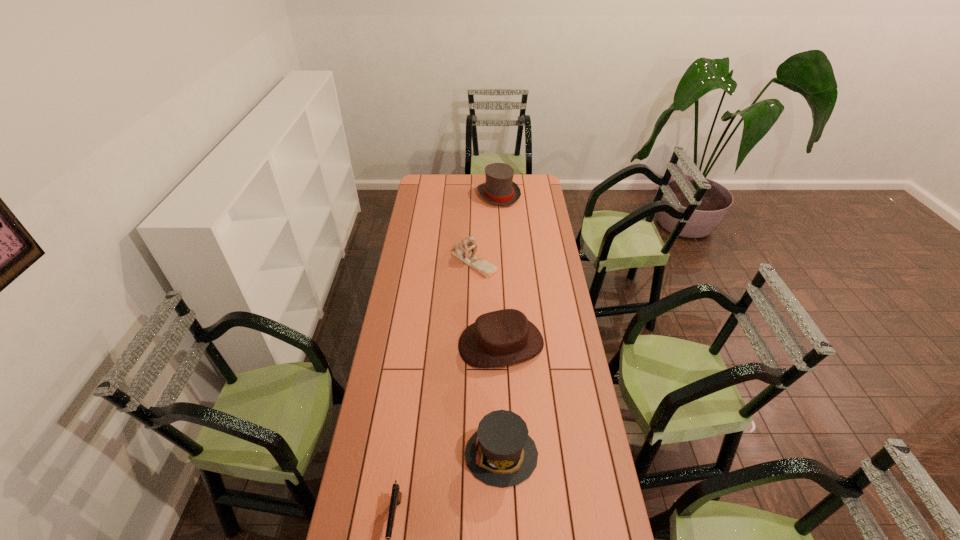
The width and height of the screenshot is (960, 540). What are the coordinates of `the farthest object` in the screenshot? It's located at (499, 189).

Find the location of a particular element. figurine is located at coordinates (x=463, y=249).

Where is `the second nearest object`? The height and width of the screenshot is (540, 960). the second nearest object is located at coordinates (500, 453).

At what (x,y) coordinates should I click in order to perform the action: click on the third farthest object. Please return your answer as a coordinate pair (x, y). This screenshot has height=540, width=960. Looking at the image, I should click on (504, 337).

I want to click on blank area located on the left of the farthest hat, so click(x=466, y=195).

Identify the location of free space located 0.150m on the front-facing side of the second farthest object. (473, 301).

At what (x,y) coordinates should I click in order to perform the action: click on free point located 0.290m with goggles on the front of the nearest hat. Please return your answer as a coordinate pair (x, y). Image resolution: width=960 pixels, height=540 pixels. Looking at the image, I should click on (377, 455).

This screenshot has height=540, width=960. I want to click on free space located with goggles on the front of the nearest hat, so click(387, 455).

At what (x,y) coordinates should I click in order to perform the action: click on vacant area situated 0.060m with goggles on the front of the nearest hat. Please return your answer as a coordinate pair (x, y). This screenshot has width=960, height=540. Looking at the image, I should click on (446, 455).

Where is `blank area located 0.050m on the back of the third farthest object`? The height and width of the screenshot is (540, 960). blank area located 0.050m on the back of the third farthest object is located at coordinates (500, 312).